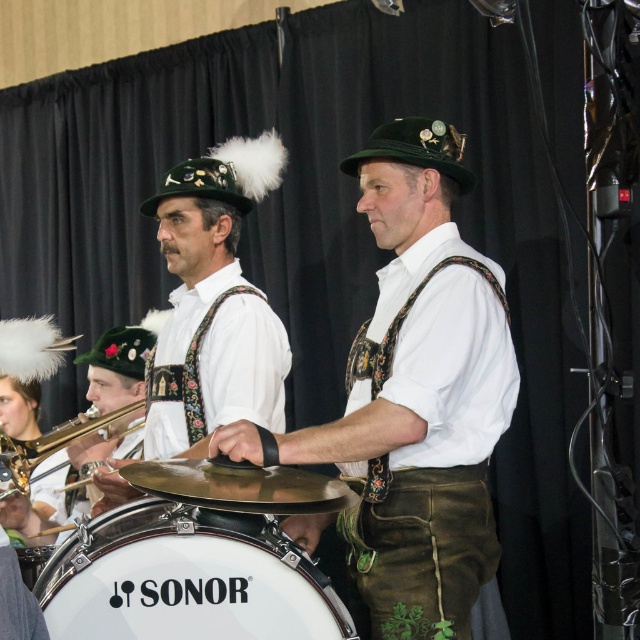
Question: Does white matte drum at center have a smaller size compared to white leather drum at center?

Choices:
 (A) yes
 (B) no

Answer: (B)

Question: Which point appears farthest from the camera in this image?

Choices:
 (A) (420, 285)
 (B) (124, 410)
 (C) (202, 522)

Answer: (B)

Question: Based on their relative distances, which object is nearer to the gold brass trumpet at lower left?

Choices:
 (A) white matte drum at center
 (B) white leather drum at center

Answer: (B)

Question: Does white matte drum at center come behind gold brass trumpet at lower left?

Choices:
 (A) no
 (B) yes

Answer: (A)

Question: Which object is positioned closest to the green leather pants at center?

Choices:
 (A) white matte drum at center
 (B) gold brass trumpet at lower left

Answer: (A)

Question: Is white matte drum at center bigger than gold brass trumpet at lower left?

Choices:
 (A) yes
 (B) no

Answer: (B)